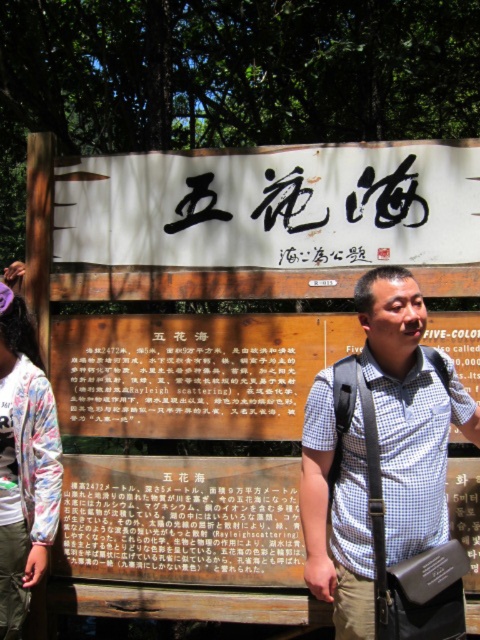
Does white checkered shirt at center have a larger size compared to matte brown signboard at center?

Yes, white checkered shirt at center is bigger than matte brown signboard at center.

Which of these two, white checkered shirt at center or matte brown signboard at center, stands shorter?

matte brown signboard at center is shorter.

The height and width of the screenshot is (640, 480). Describe the element at coordinates (409, 410) in the screenshot. I see `white checkered shirt at center` at that location.

The width and height of the screenshot is (480, 640). I want to click on white checkered shirt at center, so click(409, 410).

Describe the element at coordinates (181, 518) in the screenshot. The image size is (480, 640). I see `black paper at center` at that location.

Is black paper at center taller than wooden signboard at center?

Correct, black paper at center is much taller as wooden signboard at center.

Is point (70, 515) behind point (308, 292)?

No, it is not.

Where is `black paper at center`? black paper at center is located at coordinates (181, 518).

Measure the distance from white checkered shirt at center to printed fabric shirt at left.

white checkered shirt at center and printed fabric shirt at left are 7.96 feet apart from each other.

Is white checkered shirt at center bigger than printed fabric shirt at left?

Correct, white checkered shirt at center is larger in size than printed fabric shirt at left.

Who is more forward, (415, 348) or (24, 561)?

Point (415, 348)

Locate an element on the screen. white checkered shirt at center is located at coordinates (409, 410).